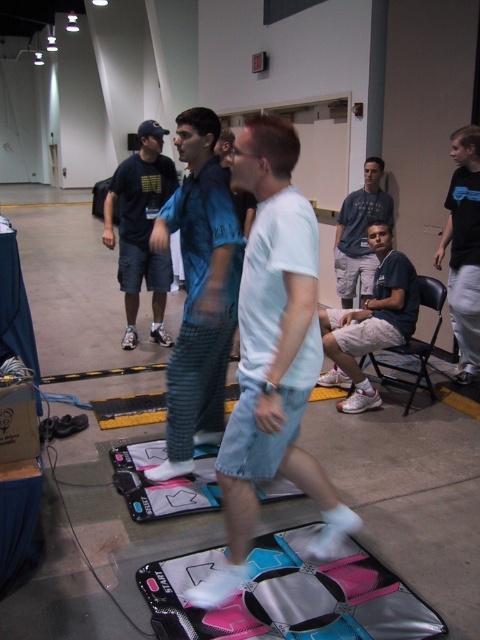
Is point (252, 237) in front of point (364, 410)?

Yes, point (252, 237) is in front of point (364, 410).

Is white cotton t-shirt at center shorter than light brown shorts at center?

No, white cotton t-shirt at center is not shorter than light brown shorts at center.

Who is more forward, [288,296] or [389,321]?

Point [288,296]

I want to click on white cotton t-shirt at center, so click(272, 355).

Between pink fabric yoga mat at lower center and blue striped pants at center, which one has more height?

blue striped pants at center is taller.

Who is shorter, pink fabric yoga mat at lower center or blue striped pants at center?

With less height is pink fabric yoga mat at lower center.

Is point (314, 621) positioned before point (190, 198)?

Yes, it is.

You are a GUI agent. You are given a task and a screenshot of the screen. Output one action in this format:
    pyautogui.click(x=<x>, y=<y>)
    Task: Click on the pink fabric yoga mat at lower center
    
    Given the screenshot: What is the action you would take?
    pyautogui.click(x=288, y=595)

Between blue striped pants at center and black matte shirt at center, which one is positioned higher?

black matte shirt at center

Describe the element at coordinates (200, 292) in the screenshot. The height and width of the screenshot is (640, 480). I see `blue striped pants at center` at that location.

Between point (211, 292) and point (459, 196), which one is positioned behind?

The point (459, 196) is more distant.

Locate an element on the screen. This screenshot has height=640, width=480. blue striped pants at center is located at coordinates [x=200, y=292].